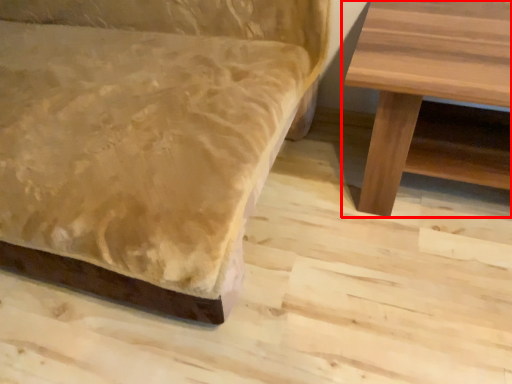
Question: From the image's perspective, where is table (annotated by the red box) located in relation to studio couch in the image?

Choices:
 (A) above
 (B) below

Answer: (B)